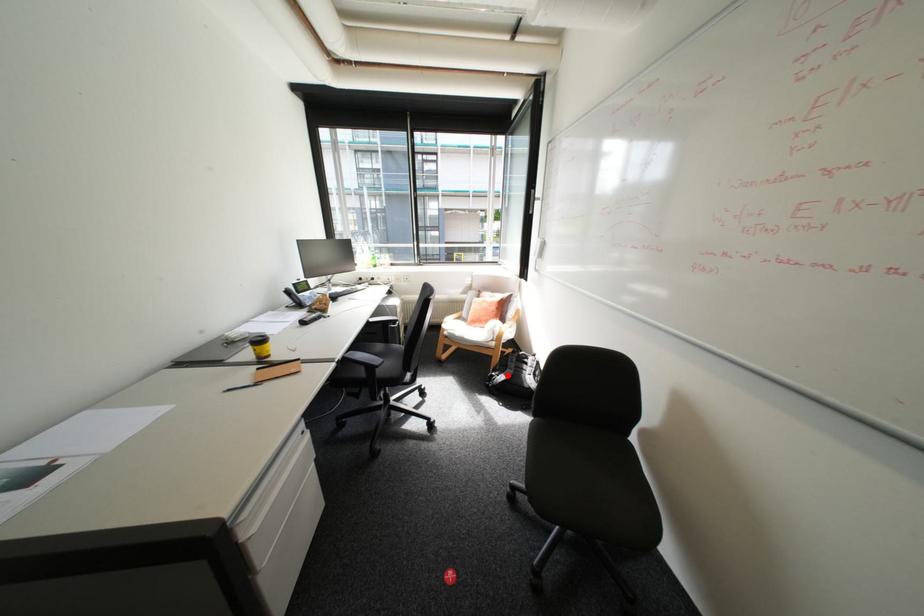
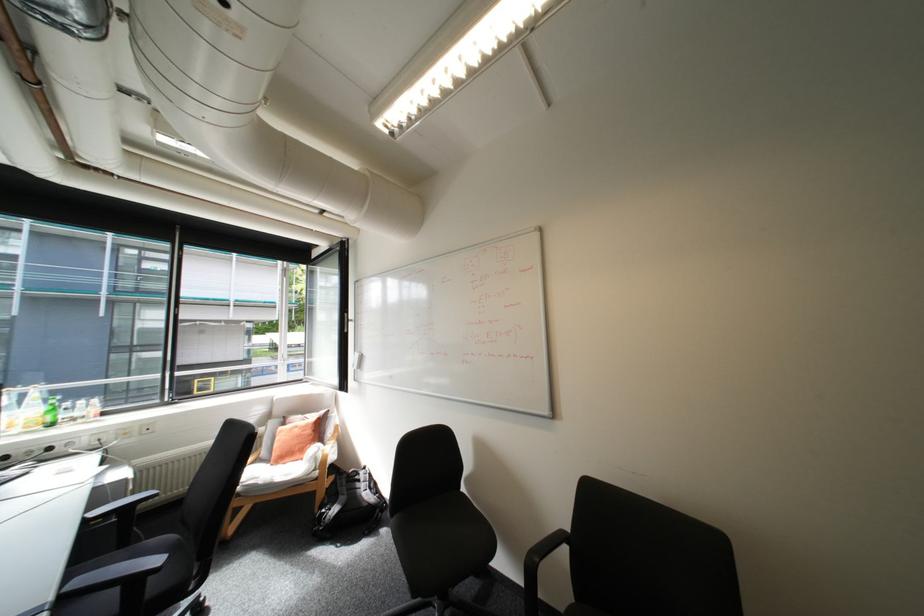
Locate, in the second image, the point that corresponds to the highlighted location in the first image.

(339, 509)